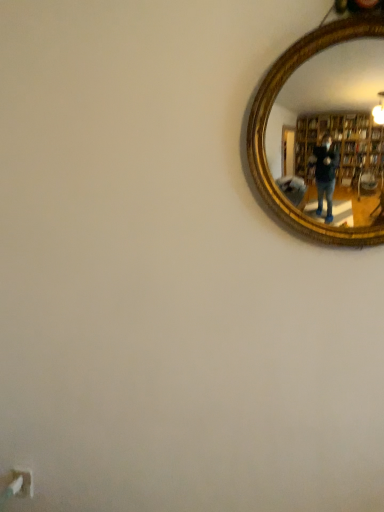
Locate an element on the screen. This screenshot has width=384, height=512. gold wooden mirror at upper right is located at coordinates (331, 115).

Describe the element at coordinates (331, 115) in the screenshot. I see `gold wooden mirror at upper right` at that location.

Locate an element on the screen. gold wooden mirror at upper right is located at coordinates (331, 115).